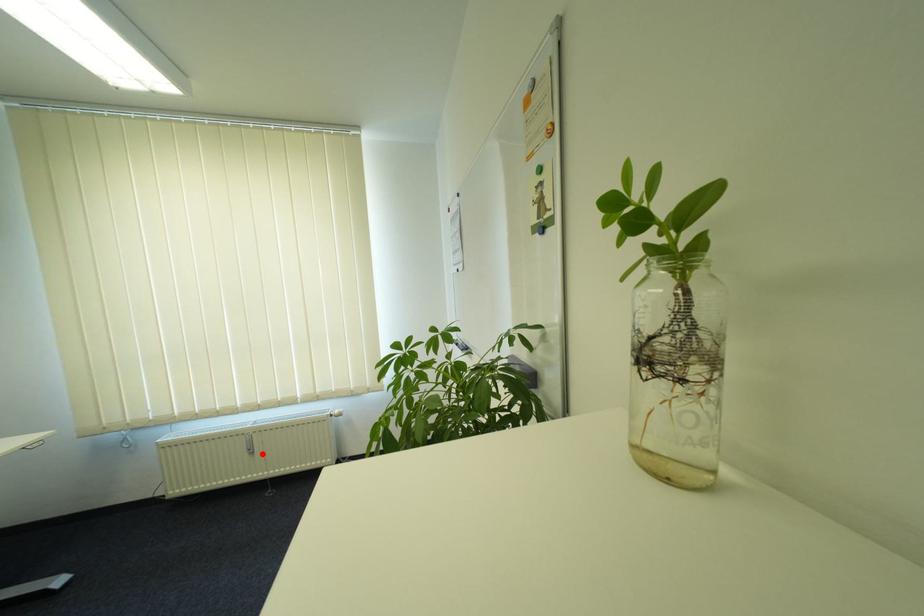
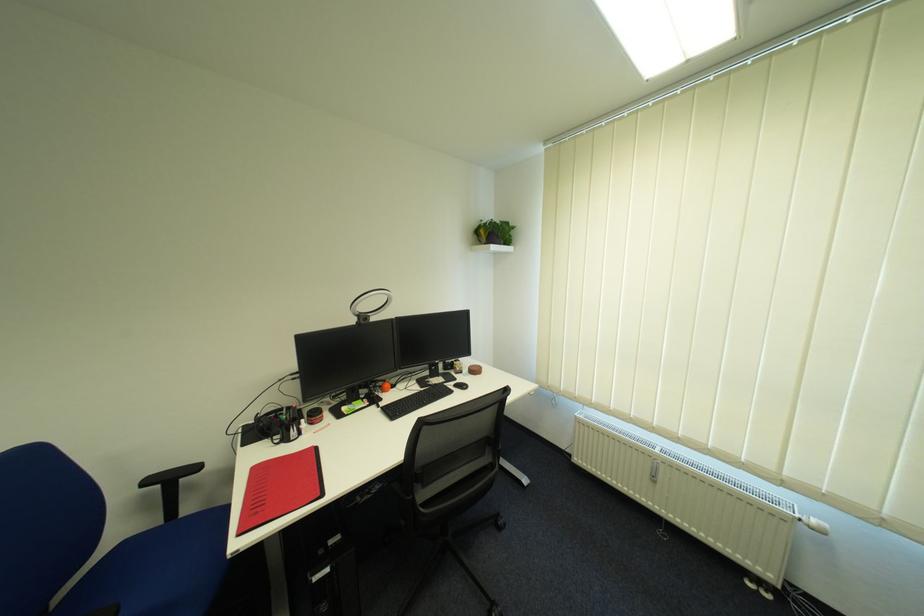
Where in the second image is the point corresponding to the highlighted location from the first image?

(664, 483)